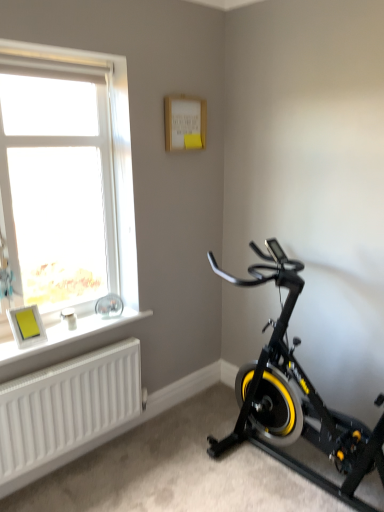
What are the coordinates of `vacant space to the right of matte yellow picture frame at lower left` in the screenshot? It's located at (69, 334).